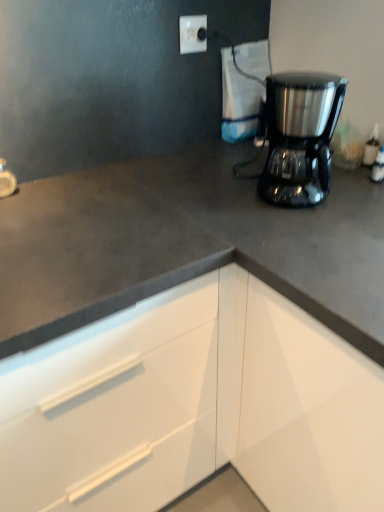
Where is `white glossy cabinet at lower right`? Image resolution: width=384 pixels, height=512 pixels. white glossy cabinet at lower right is located at coordinates (194, 406).

From a real-world perspective, between white glossy cabinet at lower right and white glossy faucet at upper left, who is vertically higher?

white glossy faucet at upper left is physically above.

Is there a large distance between white glossy cabinet at lower right and white glossy faucet at upper left?

white glossy cabinet at lower right is actually quite close to white glossy faucet at upper left.

Choose the correct answer: Is white glossy cabinet at lower right inside white glossy faucet at upper left or outside it?

white glossy cabinet at lower right is not inside white glossy faucet at upper left, it's outside.

Is white glossy cabinet at lower right positioned with its back to white glossy faucet at upper left?

white glossy cabinet at lower right does not have its back to white glossy faucet at upper left.

From the image's perspective, would you say white plastic electric outlet at upper center is positioned over white glossy cabinet at lower right?

Indeed, from the image's perspective, white plastic electric outlet at upper center is shown above white glossy cabinet at lower right.

Does white plastic electric outlet at upper center have a lesser height compared to white glossy cabinet at lower right?

Correct, white plastic electric outlet at upper center is not as tall as white glossy cabinet at lower right.

Can you tell me how much white plastic electric outlet at upper center and white glossy cabinet at lower right differ in facing direction?

There is a 2.13-degree angle between the facing directions of white plastic electric outlet at upper center and white glossy cabinet at lower right.

Considering the relative positions of white plastic electric outlet at upper center and white glossy cabinet at lower right in the image provided, is white plastic electric outlet at upper center to the left or to the right of white glossy cabinet at lower right?

white plastic electric outlet at upper center is positioned on white glossy cabinet at lower right's right side.

At what (x,y) coordinates should I click in order to perform the action: click on cabinetry located underneath the satin black coffee maker at upper right (from a real-world perspective). Please return your answer as a coordinate pair (x, y). This screenshot has width=384, height=512. Looking at the image, I should click on (194, 406).

Is satin black coffee maker at upper right taller or shorter than white glossy cabinet at lower right?

satin black coffee maker at upper right is shorter than white glossy cabinet at lower right.

Is satin black coffee maker at upper right oriented towards white glossy cabinet at lower right?

No, satin black coffee maker at upper right does not turn towards white glossy cabinet at lower right.

From a real-world perspective, is satin black coffee maker at upper right on white glossy cabinet at lower right?

Yes, from a real-world perspective, satin black coffee maker at upper right is over white glossy cabinet at lower right

Considering the positions of point (186, 21) and point (276, 175), is point (186, 21) closer or farther from the camera than point (276, 175)?

Point (186, 21) appears to be farther away from the viewer than point (276, 175).

What are the coordinates of `electric outlet that appears behind the satin black coffee maker at upper right` in the screenshot? It's located at (192, 34).

Is white plastic electric outlet at upper center placed right next to satin black coffee maker at upper right?

No, white plastic electric outlet at upper center is not making contact with satin black coffee maker at upper right.

The image size is (384, 512). In order to click on cabinetry on the right of white glossy faucet at upper left in this screenshot , I will do `click(194, 406)`.

Can you confirm if white glossy faucet at upper left is shorter than white glossy cabinet at lower right?

Correct, white glossy faucet at upper left is not as tall as white glossy cabinet at lower right.

Does point (7, 194) come in front of point (376, 437)?

No, (7, 194) is behind (376, 437).

Is white glossy faucet at upper left further to the viewer compared to satin black coffee maker at upper right?

Yes, it is behind satin black coffee maker at upper right.

Considering the sizes of objects white glossy faucet at upper left and satin black coffee maker at upper right in the image provided, who is thinner, white glossy faucet at upper left or satin black coffee maker at upper right?

white glossy faucet at upper left.

From a real-world perspective, is white glossy faucet at upper left physically below satin black coffee maker at upper right?

Yes, from a real-world perspective, white glossy faucet at upper left is beneath satin black coffee maker at upper right.

Identify the location of cabinetry lying below the satin black coffee maker at upper right (from the image's perspective). The image size is (384, 512). (194, 406).

From the picture: Can you tell me how much white glossy cabinet at lower right and satin black coffee maker at upper right differ in facing direction?

They differ by 62 degrees in their facing directions.

Does white glossy cabinet at lower right have a greater height compared to satin black coffee maker at upper right?

Correct, white glossy cabinet at lower right is much taller as satin black coffee maker at upper right.

Where is `faucet that appears behind the white glossy cabinet at lower right`? faucet that appears behind the white glossy cabinet at lower right is located at coordinates (6, 180).

At what (x,y) coordinates should I click in order to perform the action: click on cabinetry below the white plastic electric outlet at upper center (from a real-world perspective). Please return your answer as a coordinate pair (x, y). Image resolution: width=384 pixels, height=512 pixels. Looking at the image, I should click on (194, 406).

From the image, which object appears to be farther from white glossy cabinet at lower right, white plastic electric outlet at upper center or white glossy faucet at upper left?

Among the two, white plastic electric outlet at upper center is located further to white glossy cabinet at lower right.

Which object lies further to the anchor point white plastic electric outlet at upper center, white glossy faucet at upper left or white glossy cabinet at lower right?

white glossy cabinet at lower right is positioned further to the anchor white plastic electric outlet at upper center.

Based on their spatial positions, is white glossy faucet at upper left or white plastic electric outlet at upper center closer to satin black coffee maker at upper right?

Among the two, white plastic electric outlet at upper center is located nearer to satin black coffee maker at upper right.

Considering their positions, is white glossy faucet at upper left positioned closer to white plastic electric outlet at upper center than satin black coffee maker at upper right?

satin black coffee maker at upper right is closer to white plastic electric outlet at upper center.

From the image, which object appears to be farther from white plastic electric outlet at upper center, satin black coffee maker at upper right or white glossy faucet at upper left?

white glossy faucet at upper left lies further to white plastic electric outlet at upper center than the other object.

Which object lies nearer to the anchor point white glossy cabinet at lower right, white glossy faucet at upper left or white plastic electric outlet at upper center?

Among the two, white glossy faucet at upper left is located nearer to white glossy cabinet at lower right.

Looking at the image, which one is located further to white glossy cabinet at lower right, white glossy faucet at upper left or satin black coffee maker at upper right?

Based on the image, white glossy faucet at upper left appears to be further to white glossy cabinet at lower right.

Based on the photo, considering their positions, is white glossy faucet at upper left positioned further to satin black coffee maker at upper right than white glossy cabinet at lower right?

Among the two, white glossy faucet at upper left is located further to satin black coffee maker at upper right.

What are the coordinates of `faucet between white plastic electric outlet at upper center and white glossy cabinet at lower right in the up-down direction` in the screenshot? It's located at (6, 180).

Where is `home appliance between white plastic electric outlet at upper center and white glossy cabinet at lower right in the vertical direction`? The width and height of the screenshot is (384, 512). home appliance between white plastic electric outlet at upper center and white glossy cabinet at lower right in the vertical direction is located at coordinates (300, 136).

Locate an element on the screen. The image size is (384, 512). cabinetry between white glossy faucet at upper left and satin black coffee maker at upper right is located at coordinates (194, 406).

This screenshot has width=384, height=512. I want to click on electric outlet between white glossy faucet at upper left and satin black coffee maker at upper right, so click(x=192, y=34).